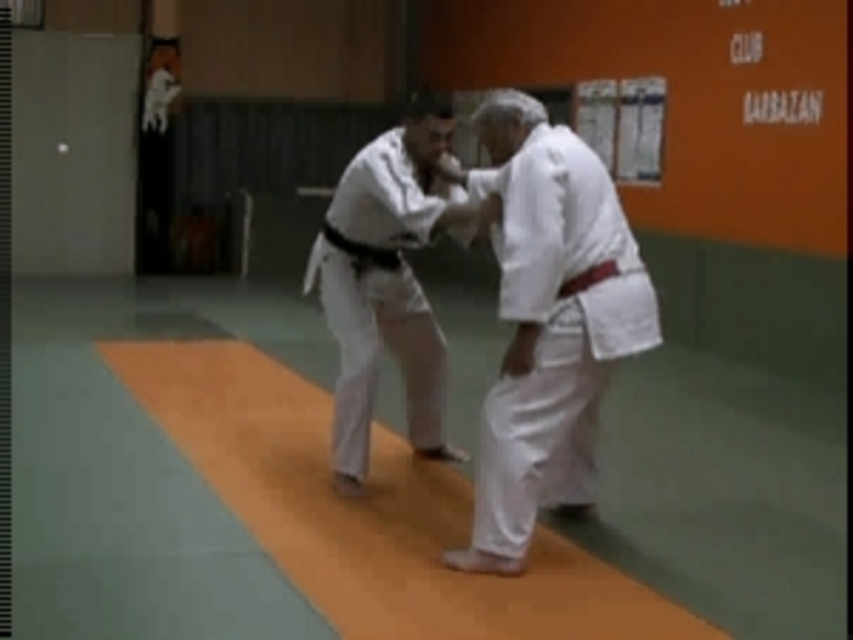
Question: Is white cloth kimono at center wider than white fabric kimono at center?

Choices:
 (A) no
 (B) yes

Answer: (B)

Question: Which of the following is the closest to the observer?

Choices:
 (A) (344, 353)
 (B) (541, 275)

Answer: (B)

Question: Is white cloth kimono at center smaller than white fabric kimono at center?

Choices:
 (A) no
 (B) yes

Answer: (A)

Question: Which object appears closest to the camera in this image?

Choices:
 (A) white fabric kimono at center
 (B) white cloth kimono at center

Answer: (B)

Question: Which point is farther to the camera?

Choices:
 (A) click(502, 502)
 (B) click(397, 288)

Answer: (B)

Question: Observing the image, what is the correct spatial positioning of white cloth kimono at center in reference to white fabric kimono at center?

Choices:
 (A) above
 (B) below

Answer: (A)